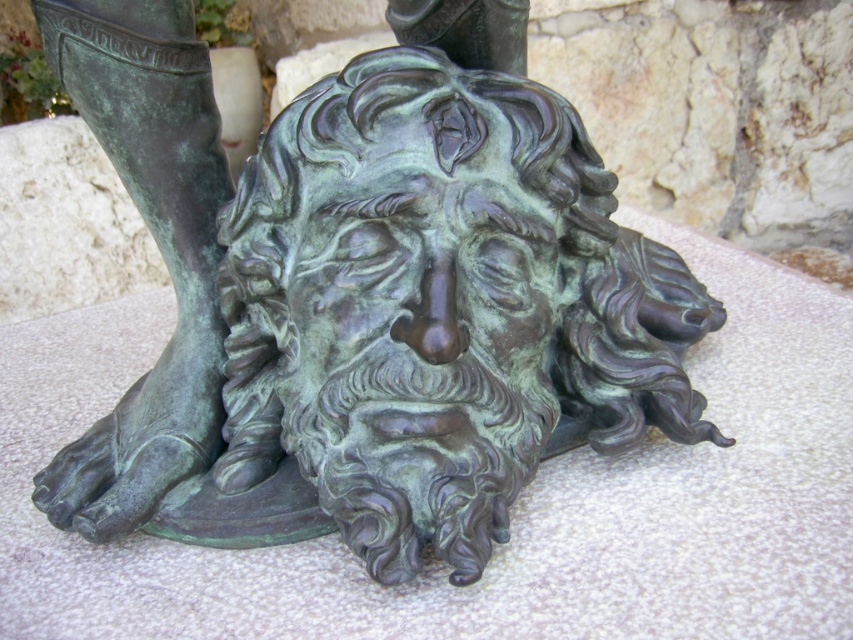
The image size is (853, 640). Describe the element at coordinates (421, 321) in the screenshot. I see `green patina bronze face at center` at that location.

Consider the image. Is green patina bronze face at center smaller than green patina boot at lower left?

Yes, green patina bronze face at center is smaller than green patina boot at lower left.

This screenshot has height=640, width=853. Describe the element at coordinates (421, 321) in the screenshot. I see `green patina bronze face at center` at that location.

This screenshot has height=640, width=853. I want to click on green patina bronze face at center, so click(x=421, y=321).